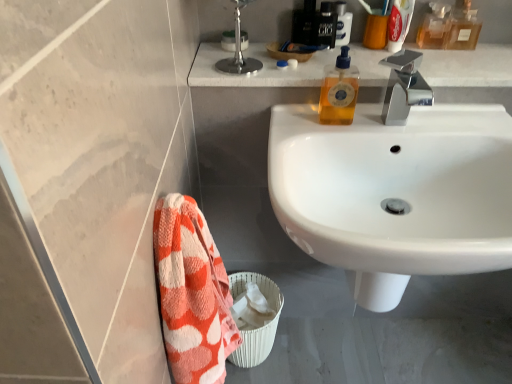
Identify the location of free location to the left of yellow liquid soap at upper right, which appears as the 3th toiletry when viewed from the top. The height and width of the screenshot is (384, 512). (297, 121).